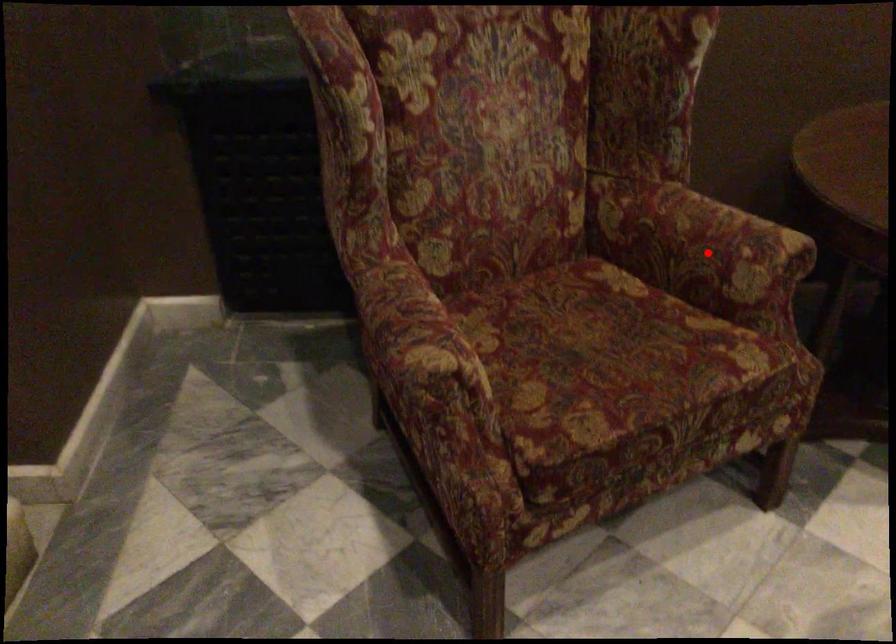
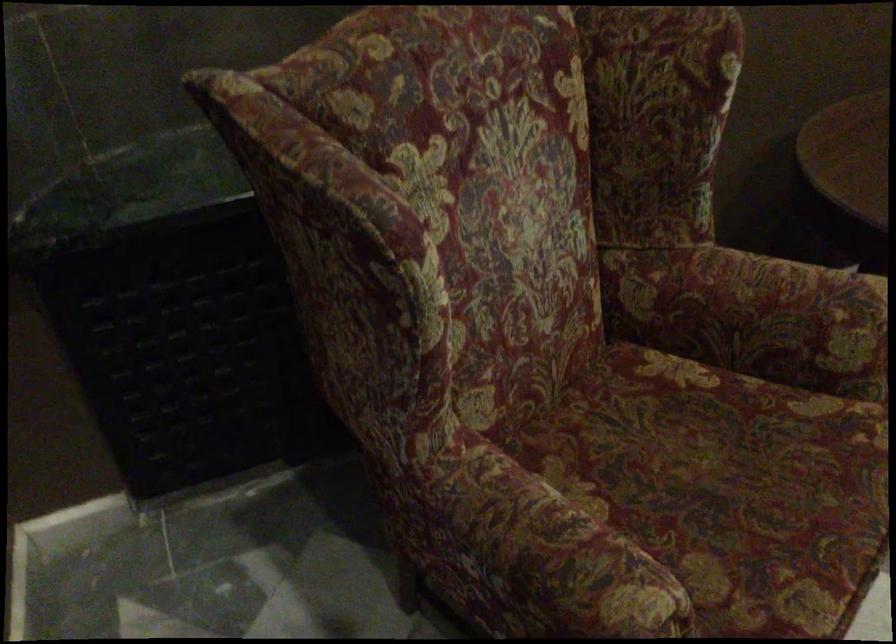
Question: I am providing you with two images of the same scene from different viewpoints. In image1, a red point is highlighted. Considering the same 3D point in image2, which of the following is correct?

Choices:
 (A) It is closer
 (B) It is farther

Answer: (A)